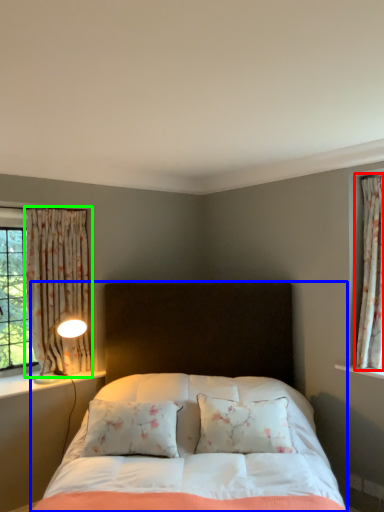
Question: Based on their relative distances, which object is farther from curtain (highlighted by a red box)? Choose from bed (highlighted by a blue box) and curtain (highlighted by a green box).

Choices:
 (A) bed
 (B) curtain

Answer: (B)